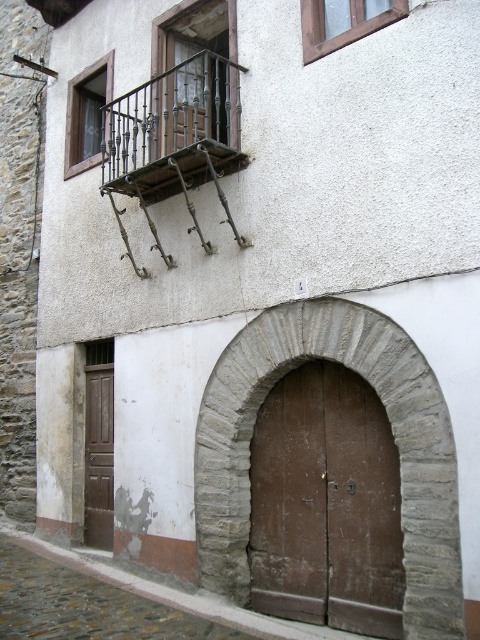
What do you see at coordinates (325, 504) in the screenshot? I see `brown wooden door at center` at bounding box center [325, 504].

Between brown wooden door at center and brown wooden door at lower left, which one is positioned lower?

Positioned lower is brown wooden door at lower left.

Which is behind, point (330, 536) or point (92, 524)?

The point (92, 524) is behind.

The height and width of the screenshot is (640, 480). In order to click on brown wooden door at center in this screenshot , I will do `click(325, 504)`.

Does stone arched doorway at center have a smaller size compared to brown wooden door at center?

No.

Is the position of stone arched doorway at center less distant than that of brown wooden door at center?

Yes, it is in front of brown wooden door at center.

Does point (249, 486) lie behind point (348, 461)?

Yes, it is behind point (348, 461).

The width and height of the screenshot is (480, 640). I want to click on stone arched doorway at center, so click(x=393, y=435).

Is stone arched doorway at center taller than dark brown wrought iron balcony at upper left?

Yes.

Can you confirm if stone arched doorway at center is positioned to the left of dark brown wrought iron balcony at upper left?

No, stone arched doorway at center is not to the left of dark brown wrought iron balcony at upper left.

The height and width of the screenshot is (640, 480). I want to click on stone arched doorway at center, so click(x=393, y=435).

At what (x,y) coordinates should I click in order to perform the action: click on stone arched doorway at center. Please return your answer as a coordinate pair (x, y). Looking at the image, I should click on (393, 435).